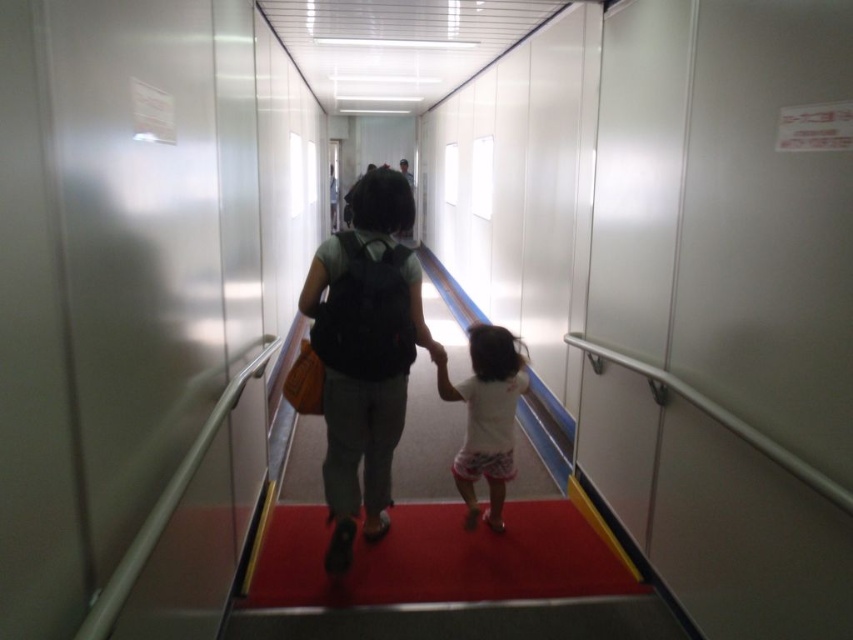
Which of these two, matte black backpack at center or white cotton shirt at center, stands taller?

matte black backpack at center

Which is behind, point (403, 416) or point (463, 472)?

Positioned behind is point (463, 472).

Where is `matte black backpack at center`? The image size is (853, 640). matte black backpack at center is located at coordinates (364, 352).